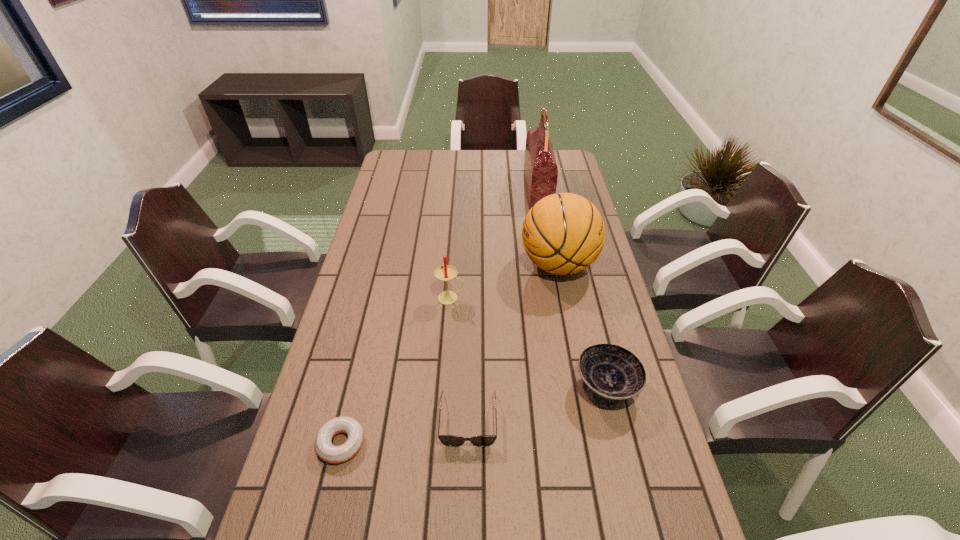
Where is `vacant space that satisfies the following two spatial constraints: 1. on the surface of the basketball near the brand logo; 2. on the front side of the candle`? The image size is (960, 540). vacant space that satisfies the following two spatial constraints: 1. on the surface of the basketball near the brand logo; 2. on the front side of the candle is located at coordinates (564, 298).

Locate an element on the screen. The width and height of the screenshot is (960, 540). free spot that satisfies the following two spatial constraints: 1. on the front-facing side of the bowl; 2. on the right side of the tallest object is located at coordinates (573, 387).

Locate an element on the screen. Image resolution: width=960 pixels, height=540 pixels. vacant space that satisfies the following two spatial constraints: 1. on the surface of the basketball near the brand logo; 2. on the front side of the candle is located at coordinates (564, 298).

Identify the location of free region that satisfies the following two spatial constraints: 1. on the surface of the fifth shortest object near the brand logo; 2. on the left side of the bowl. (582, 387).